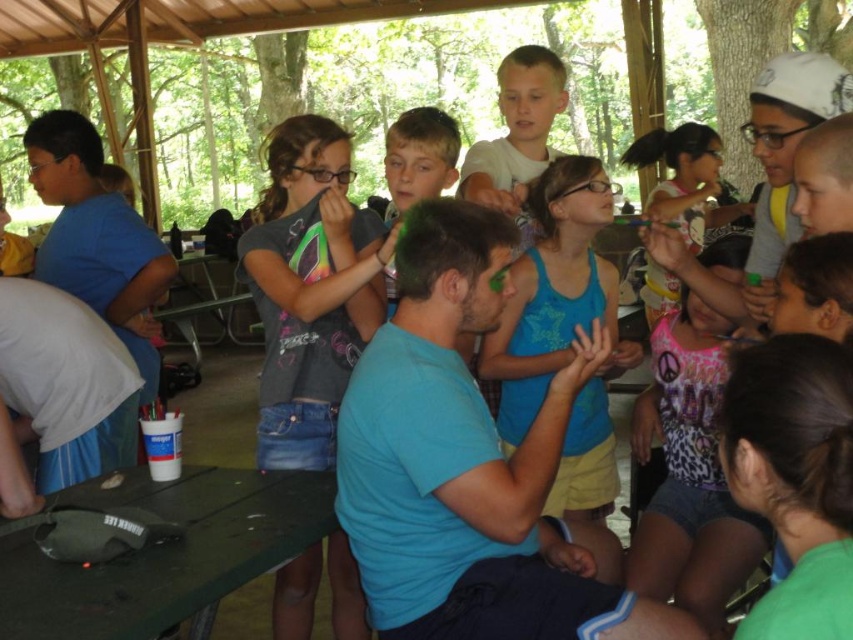
Is point (207, 600) more distant than point (569, 314)?

No, (207, 600) is in front of (569, 314).

Which is more to the left, green matte fanny pack at lower left or blue cotton tank top at center?

From the viewer's perspective, green matte fanny pack at lower left appears more on the left side.

Does point (169, 604) come farther from viewer compared to point (535, 385)?

No, it is in front of (535, 385).

At what (x,y) coordinates should I click in order to perform the action: click on green matte fanny pack at lower left. Please return your answer as a coordinate pair (x, y). The height and width of the screenshot is (640, 853). Looking at the image, I should click on (164, 552).

Can you confirm if matte gray shirt at center is taller than pink leopard print tank top at center?

Correct, matte gray shirt at center is much taller as pink leopard print tank top at center.

Which is above, matte gray shirt at center or pink leopard print tank top at center?

Positioned higher is matte gray shirt at center.

This screenshot has width=853, height=640. What are the coordinates of `matte gray shirt at center` in the screenshot? It's located at (310, 289).

How far apart are matte gray shirt at center and blue cotton tank top at center?

A distance of 20.68 inches exists between matte gray shirt at center and blue cotton tank top at center.

Based on the photo, which is more to the left, matte gray shirt at center or blue cotton tank top at center?

Positioned to the left is matte gray shirt at center.

Measure the distance between matte gray shirt at center and camera.

They are 6.04 feet apart.

The height and width of the screenshot is (640, 853). What are the coordinates of `matte gray shirt at center` in the screenshot? It's located at (310, 289).